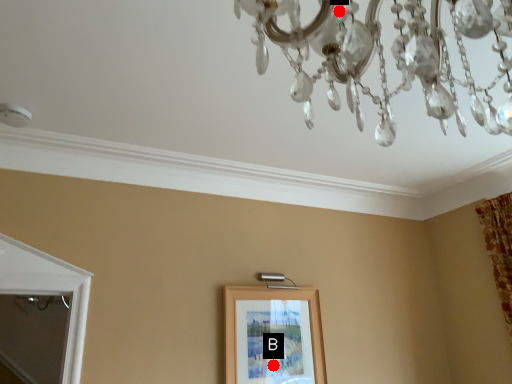
Question: Two points are circled on the image, labeled by A and B beside each circle. Among these points, which one is farthest from the camera?

Choices:
 (A) A is further
 (B) B is further

Answer: (B)